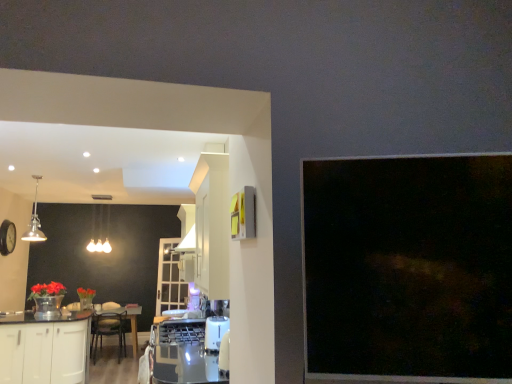
Question: Considering the positions of wooden round table at center and clear glass door at center in the image, is wooden round table at center bigger or smaller than clear glass door at center?

Choices:
 (A) small
 (B) big

Answer: (B)

Question: Do you think wooden round table at center is within clear glass door at center, or outside of it?

Choices:
 (A) inside
 (B) outside

Answer: (B)

Question: Estimate the real-world distances between objects in this image. Which object is farther from the wooden round table at center?

Choices:
 (A) matte glass chandelier at upper center
 (B) white glossy cabinetry at lower left
 (C) clear glass door at center

Answer: (A)

Question: Based on their relative distances, which object is nearer to the wooden round table at center?

Choices:
 (A) matte glass chandelier at upper center
 (B) clear glass door at center
 (C) white glossy cabinetry at lower left

Answer: (B)